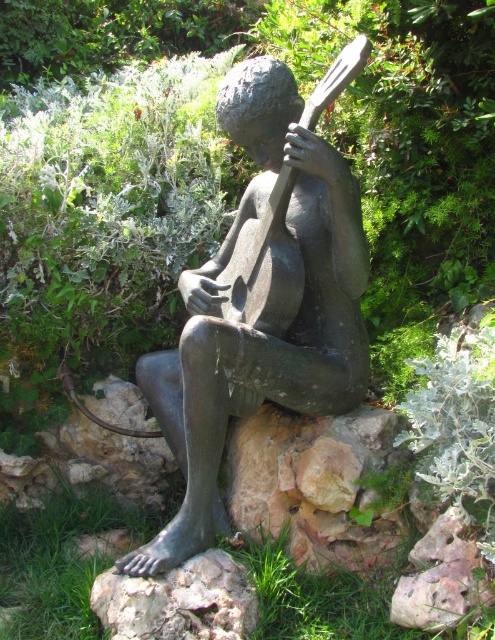
Is bronze statue at center smaller than bronze guitar at center?

No.

Does bronze statue at center appear on the right side of bronze guitar at center?

Incorrect, bronze statue at center is not on the right side of bronze guitar at center.

Describe the element at coordinates (262, 296) in the screenshot. I see `bronze statue at center` at that location.

You are a GUI agent. You are given a task and a screenshot of the screen. Output one action in this format:
    pyautogui.click(x=<x>, y=<y>)
    Task: Click on the bronze statue at center
    
    Given the screenshot: What is the action you would take?
    pyautogui.click(x=262, y=296)

Is gray stone at lower center positioned before bronze guitar at center?

Yes, it is.

Does gray stone at lower center have a lesser width compared to bronze guitar at center?

No.

Which is behind, point (141, 611) or point (260, 314)?

Point (260, 314)

Where is `gray stone at lower center`? Image resolution: width=495 pixels, height=640 pixels. gray stone at lower center is located at coordinates (179, 602).

Is bronze statue at center below gray stone at lower center?

Incorrect, bronze statue at center is not positioned below gray stone at lower center.

Who is more distant from viewer, (279,113) or (156,595)?

Point (279,113)

Locate an element on the screen. bronze statue at center is located at coordinates (262, 296).